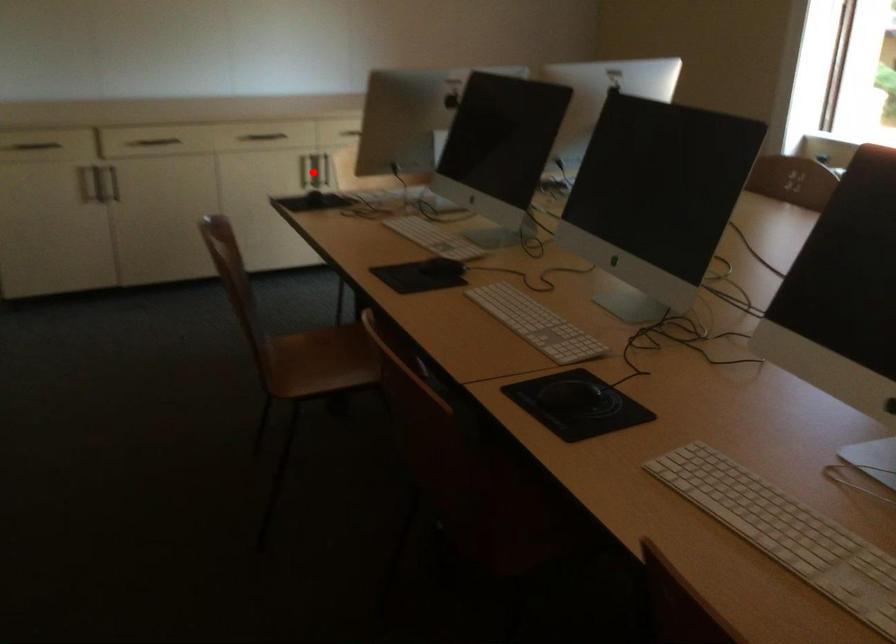
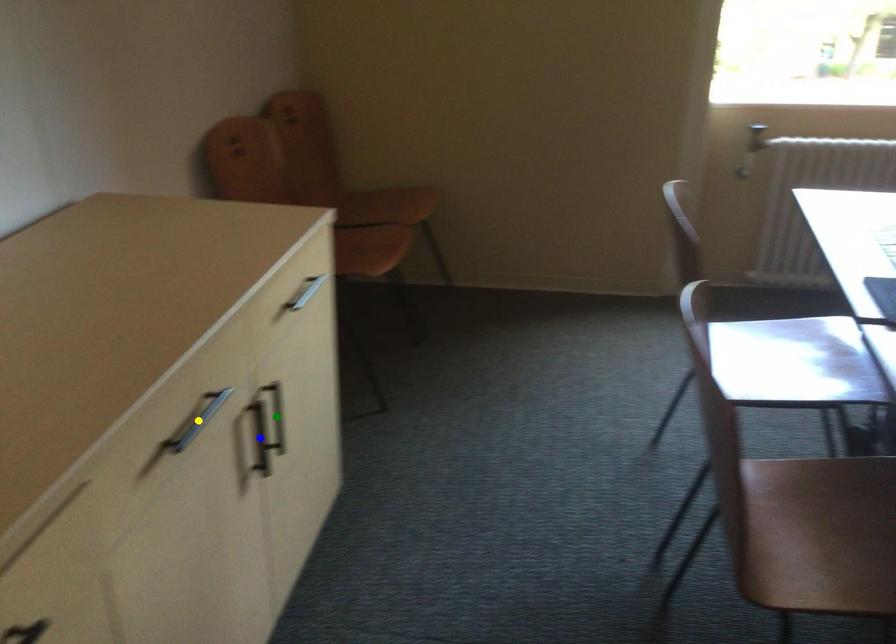
Question: I am providing you with two images of the same scene from different viewpoints. A red point is marked on the first image. You are given multiple points on the second image. Can you choose the point in image 2 that corresponds to the point in image 1?

Choices:
 (A) blue point
 (B) green point
 (C) yellow point

Answer: (A)